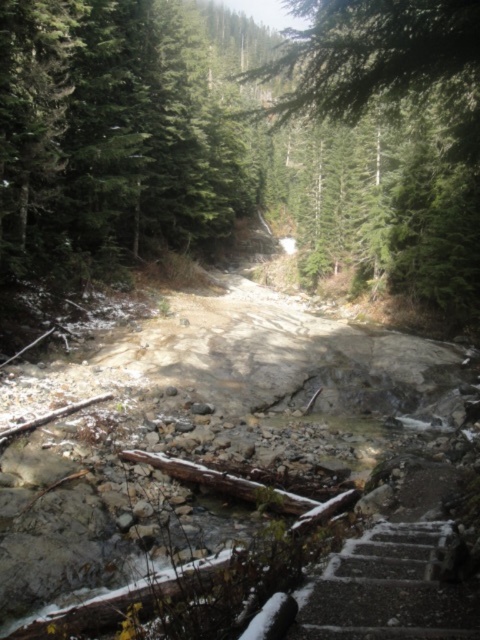
You are standing in the forest scene and want to walk from the point at coordinates point (441, 296) to the point at coordinates point (374, 538). Which direction should you move to get closer to your destination?

To move from point (441, 296) to point (374, 538), you should move towards the lower right direction since point (441, 296) is further away from the viewer compared to point (374, 538), indicating it is positioned behind in the scene.

Looking at this image, you are a hiker trying to navigate through the forest. You see a brown rocky dirt track at center and a green matte tree at center. Which one is taller?

The brown rocky dirt track at center is not as tall as the green matte tree at center, so the green matte tree at center is taller.